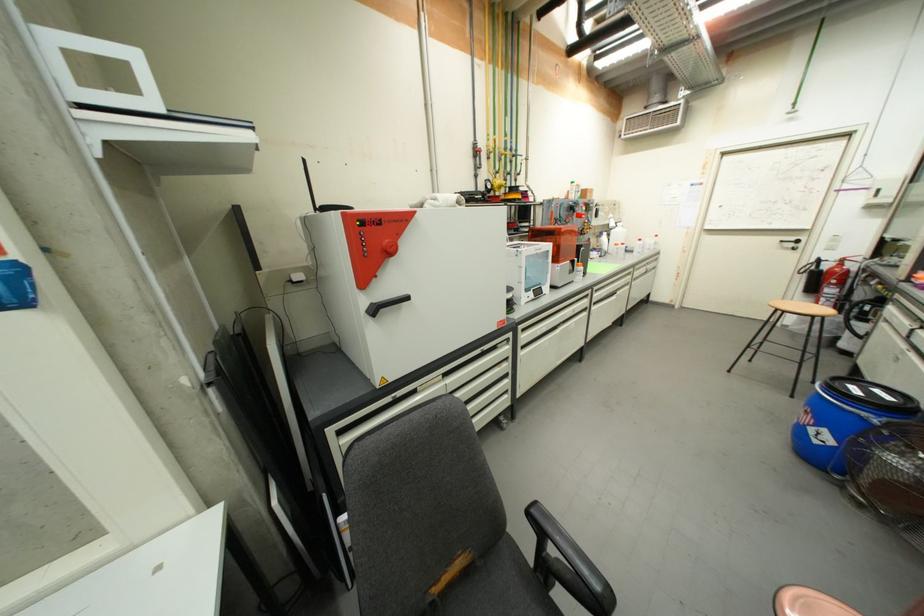
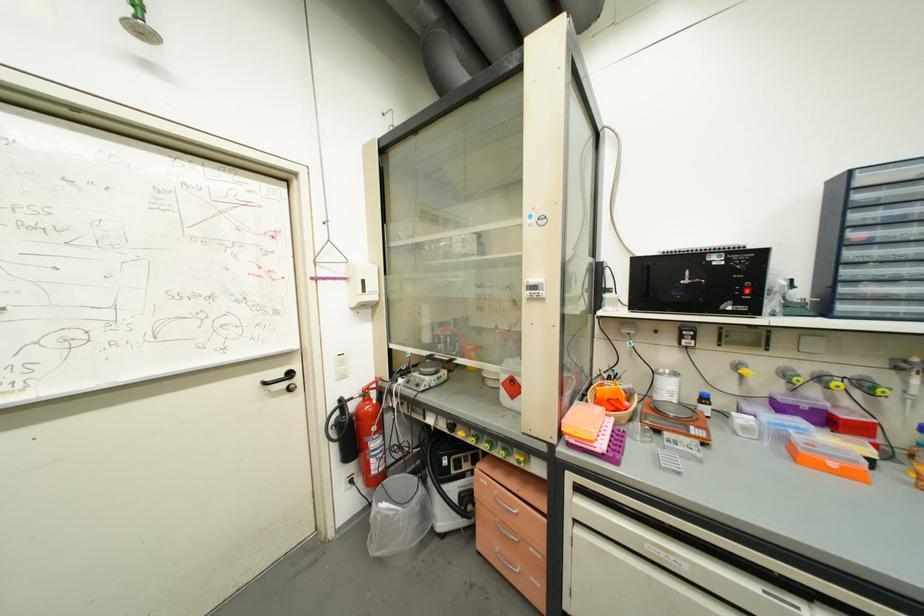
The point at (796, 246) is marked in the first image. Where is the corresponding point in the second image?

(289, 387)